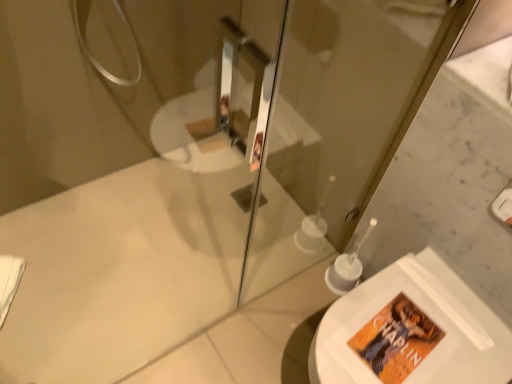
Question: Considering the positions of white glossy toilet at lower right and transparent glass screen door at upper center in the image, is white glossy toilet at lower right bigger or smaller than transparent glass screen door at upper center?

Choices:
 (A) big
 (B) small

Answer: (A)

Question: Considering their positions, is white glossy toilet at lower right located in front of or behind transparent glass screen door at upper center?

Choices:
 (A) front
 (B) behind

Answer: (B)

Question: Does point (328, 347) appear closer or farther from the camera than point (314, 3)?

Choices:
 (A) closer
 (B) farther

Answer: (A)

Question: Is transparent glass screen door at upper center wider or thinner than white glossy toilet at lower right?

Choices:
 (A) thin
 (B) wide

Answer: (A)

Question: Considering the positions of transparent glass screen door at upper center and white glossy toilet at lower right in the image, is transparent glass screen door at upper center taller or shorter than white glossy toilet at lower right?

Choices:
 (A) tall
 (B) short

Answer: (A)

Question: Looking at the image, does transparent glass screen door at upper center seem bigger or smaller compared to white glossy toilet at lower right?

Choices:
 (A) big
 (B) small

Answer: (B)

Question: Is point [x=306, y=160] closer or farther from the camera than point [x=335, y=327]?

Choices:
 (A) closer
 (B) farther

Answer: (B)